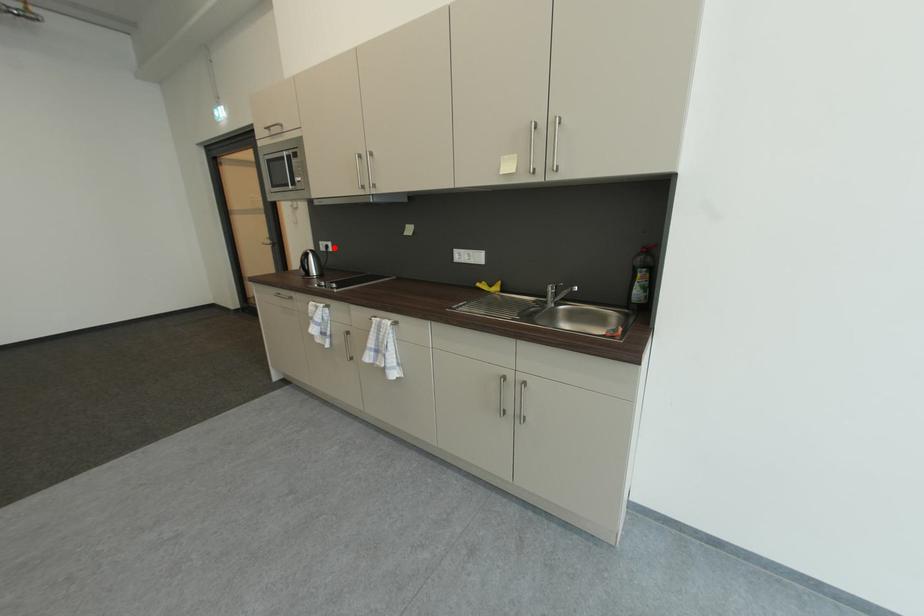
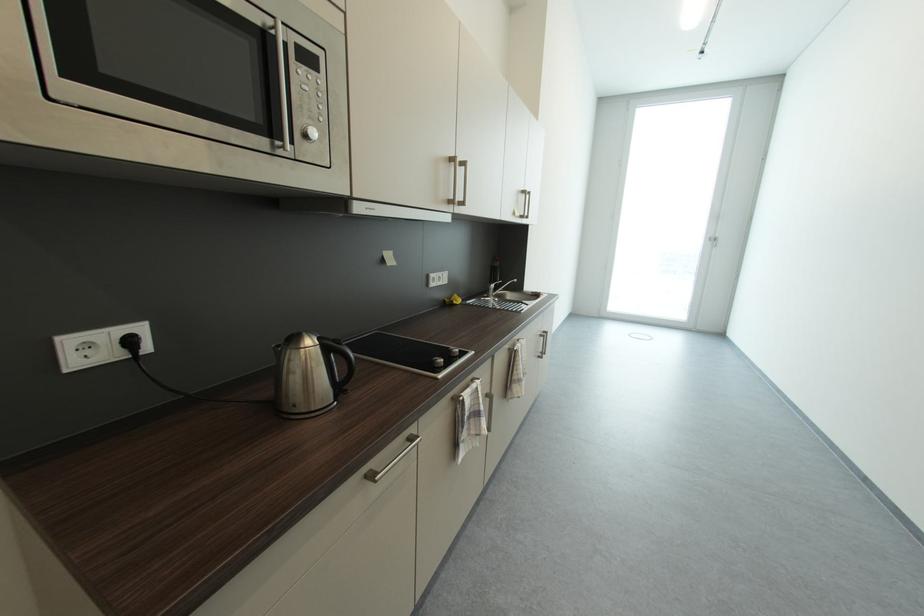
In the second image, find the point that corresponds to the highlighted location in the first image.

(137, 344)